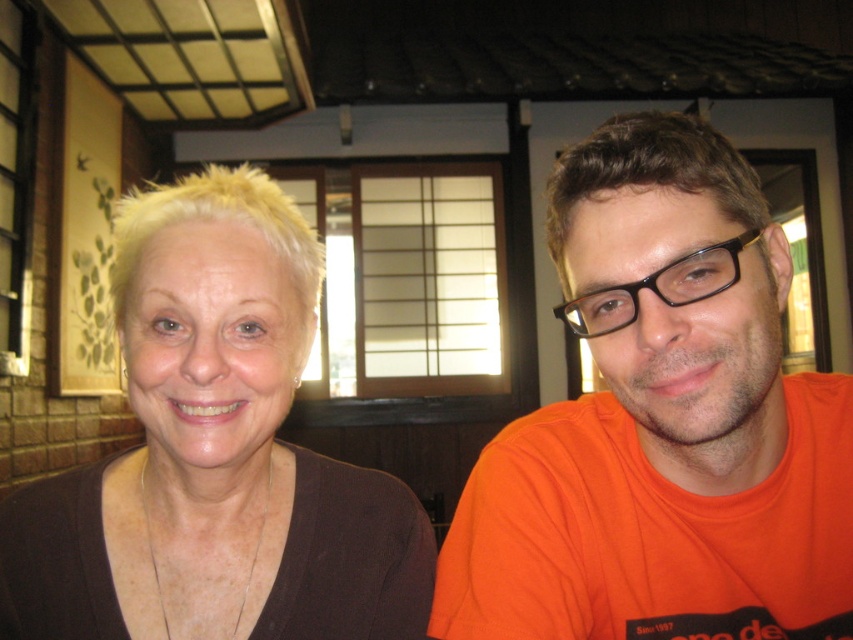
Question: Is orange cotton t-shirt at right in front of matte brown shirt at left?

Choices:
 (A) yes
 (B) no

Answer: (A)

Question: Which point is farther to the camera?

Choices:
 (A) matte brown shirt at left
 (B) orange cotton t-shirt at right

Answer: (A)

Question: Is orange cotton t-shirt at right closer to camera compared to matte brown shirt at left?

Choices:
 (A) yes
 (B) no

Answer: (A)

Question: Which point is farther to the camera?

Choices:
 (A) (238, 467)
 (B) (607, 440)

Answer: (B)

Question: Can you confirm if orange cotton t-shirt at right is positioned below matte brown shirt at left?

Choices:
 (A) yes
 (B) no

Answer: (B)